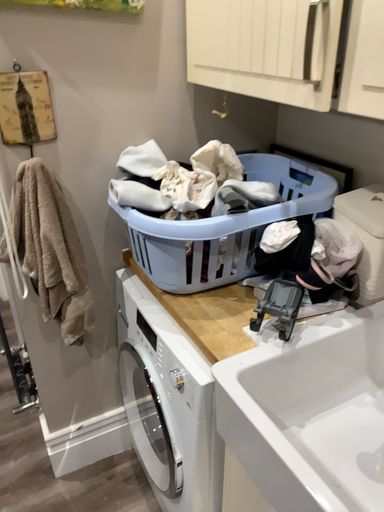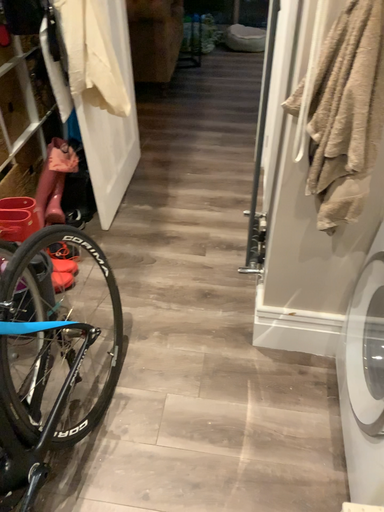
Question: How did the camera likely rotate when shooting the video?

Choices:
 (A) rotated left
 (B) rotated right

Answer: (A)